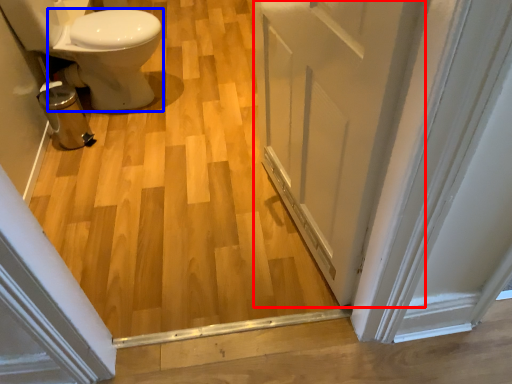
Question: Which object appears closest to the camera in this image, door (highlighted by a red box) or bidet (highlighted by a blue box)?

Choices:
 (A) door
 (B) bidet

Answer: (A)